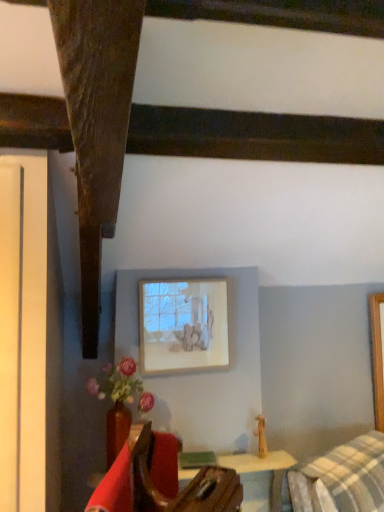
Question: From a real-world perspective, is velvet red armchair at lower left positioned under matte ceramic vase at lower left based on gravity?

Choices:
 (A) yes
 (B) no

Answer: (A)

Question: Is velvet red armchair at lower left taller than matte ceramic vase at lower left?

Choices:
 (A) no
 (B) yes

Answer: (A)

Question: Is velvet red armchair at lower left wider than matte ceramic vase at lower left?

Choices:
 (A) yes
 (B) no

Answer: (B)

Question: Considering the relative positions of velvet red armchair at lower left and matte ceramic vase at lower left in the image provided, is velvet red armchair at lower left to the right of matte ceramic vase at lower left from the viewer's perspective?

Choices:
 (A) no
 (B) yes

Answer: (B)

Question: Is velvet red armchair at lower left behind matte ceramic vase at lower left?

Choices:
 (A) no
 (B) yes

Answer: (A)

Question: Does velvet red armchair at lower left have a lesser width compared to matte ceramic vase at lower left?

Choices:
 (A) no
 (B) yes

Answer: (B)

Question: Is matte white picture frame at upper center to the right of matte ceramic vase at lower left from the viewer's perspective?

Choices:
 (A) no
 (B) yes

Answer: (B)

Question: Is matte white picture frame at upper center far away from matte ceramic vase at lower left?

Choices:
 (A) no
 (B) yes

Answer: (A)

Question: Can you confirm if matte white picture frame at upper center is thinner than matte ceramic vase at lower left?

Choices:
 (A) yes
 (B) no

Answer: (A)

Question: Does matte white picture frame at upper center have a greater height compared to matte ceramic vase at lower left?

Choices:
 (A) yes
 (B) no

Answer: (A)

Question: Is matte white picture frame at upper center not within matte ceramic vase at lower left?

Choices:
 (A) yes
 (B) no

Answer: (A)

Question: Does matte white picture frame at upper center touch matte ceramic vase at lower left?

Choices:
 (A) no
 (B) yes

Answer: (A)

Question: From the image's perspective, is matte white picture frame at upper center located beneath velvet red armchair at lower left?

Choices:
 (A) yes
 (B) no

Answer: (B)